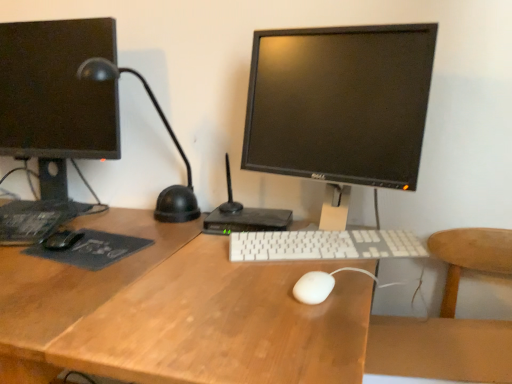
Question: Can you confirm if matte black monitor at left, which is counted as the second computer monitor, starting from the right, is wider than wooden at right?

Choices:
 (A) yes
 (B) no

Answer: (B)

Question: Is the position of matte black monitor at left, placed as the 1th computer monitor when sorted from left to right, less distant than that of wooden at right?

Choices:
 (A) yes
 (B) no

Answer: (B)

Question: Is matte black monitor at left, placed as the 1th computer monitor when sorted from left to right, taller than wooden at right?

Choices:
 (A) yes
 (B) no

Answer: (A)

Question: From the image's perspective, is matte black monitor at left, which is counted as the second computer monitor, starting from the right, located beneath wooden at right?

Choices:
 (A) yes
 (B) no

Answer: (B)

Question: Can you confirm if matte black monitor at left, which is counted as the second computer monitor, starting from the right, is thinner than wooden at right?

Choices:
 (A) no
 (B) yes

Answer: (B)

Question: Is wooden at right surrounded by matte black monitor at left, placed as the 1th computer monitor when sorted from left to right?

Choices:
 (A) yes
 (B) no

Answer: (B)

Question: Does white matte mouse at center, which appears as the first mouse when viewed from the front, have a lesser height compared to white plastic keyboard at center?

Choices:
 (A) yes
 (B) no

Answer: (A)

Question: Is white matte mouse at center, the second mouse viewed from the left, wider than white plastic keyboard at center?

Choices:
 (A) yes
 (B) no

Answer: (B)

Question: Is white matte mouse at center, the second mouse from the back, further to camera compared to white plastic keyboard at center?

Choices:
 (A) yes
 (B) no

Answer: (B)

Question: Is white matte mouse at center, which ranks as the 1th mouse in bottom-to-top order, taller than white plastic keyboard at center?

Choices:
 (A) yes
 (B) no

Answer: (B)

Question: Is white matte mouse at center, the second mouse from the back, at the right side of white plastic keyboard at center?

Choices:
 (A) no
 (B) yes

Answer: (A)

Question: Considering the relative sizes of white matte mouse at center, the second mouse from the back, and white plastic keyboard at center in the image provided, is white matte mouse at center, the second mouse from the back, smaller than white plastic keyboard at center?

Choices:
 (A) yes
 (B) no

Answer: (A)

Question: Considering the relative sizes of black matte mouse at left, the 2th mouse positioned from the bottom, and dark gray matte mousepad at left in the image provided, is black matte mouse at left, the 2th mouse positioned from the bottom, shorter than dark gray matte mousepad at left?

Choices:
 (A) yes
 (B) no

Answer: (B)